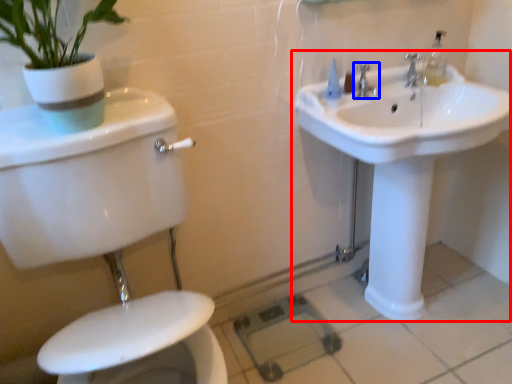
Question: Which point is closer to the camera, sink (highlighted by a red box) or tap (highlighted by a blue box)?

Choices:
 (A) sink
 (B) tap

Answer: (A)